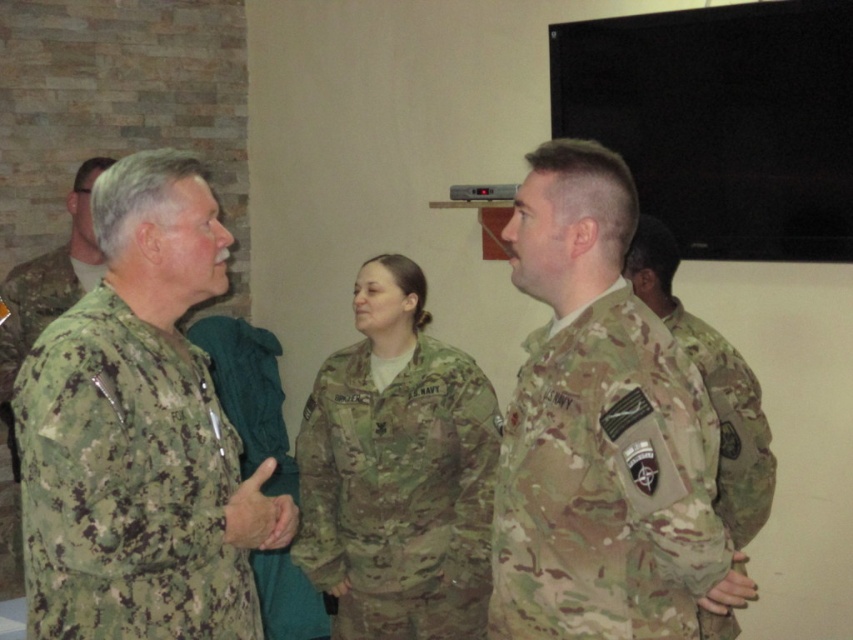
How distant is camouflage uniform at right from camouflage fabric uniform at right?

The distance of camouflage uniform at right from camouflage fabric uniform at right is 18.95 inches.

What do you see at coordinates (598, 429) in the screenshot? This screenshot has width=853, height=640. I see `camouflage uniform at right` at bounding box center [598, 429].

This screenshot has height=640, width=853. What are the coordinates of `camouflage uniform at right` in the screenshot? It's located at click(598, 429).

Does camouflage fabric uniform at left have a larger size compared to camouflage uniform at center?

Incorrect, camouflage fabric uniform at left is not larger than camouflage uniform at center.

Does camouflage fabric uniform at left have a greater width compared to camouflage uniform at center?

No, camouflage fabric uniform at left is not wider than camouflage uniform at center.

At what (x,y) coordinates should I click in order to perform the action: click on camouflage fabric uniform at left. Please return your answer as a coordinate pair (x, y). The width and height of the screenshot is (853, 640). Looking at the image, I should click on (126, 484).

You are a GUI agent. You are given a task and a screenshot of the screen. Output one action in this format:
    pyautogui.click(x=<x>, y=<y>)
    Task: Click on the camouflage fabric uniform at left
    This screenshot has height=640, width=853.
    Given the screenshot: What is the action you would take?
    pyautogui.click(x=126, y=484)

In the scene shown: Can you confirm if camouflage uniform at center is positioned below camouflage fabric uniform at right?

Indeed, camouflage uniform at center is positioned under camouflage fabric uniform at right.

Is point (438, 470) positioned after point (718, 348)?

Yes.

Which is behind, point (374, 436) or point (666, 257)?

The point (374, 436) is behind.

Where is `camouflage uniform at center`? The image size is (853, 640). camouflage uniform at center is located at coordinates (397, 472).